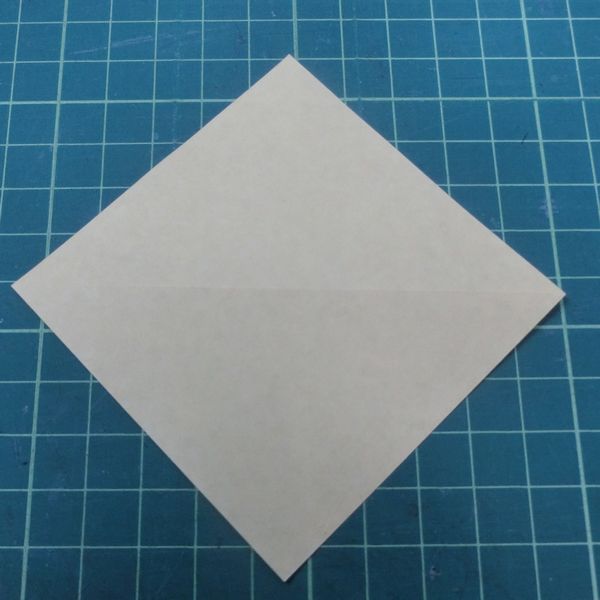
Where is `small blue tile squares`? The width and height of the screenshot is (600, 600). small blue tile squares is located at coordinates (512, 460).